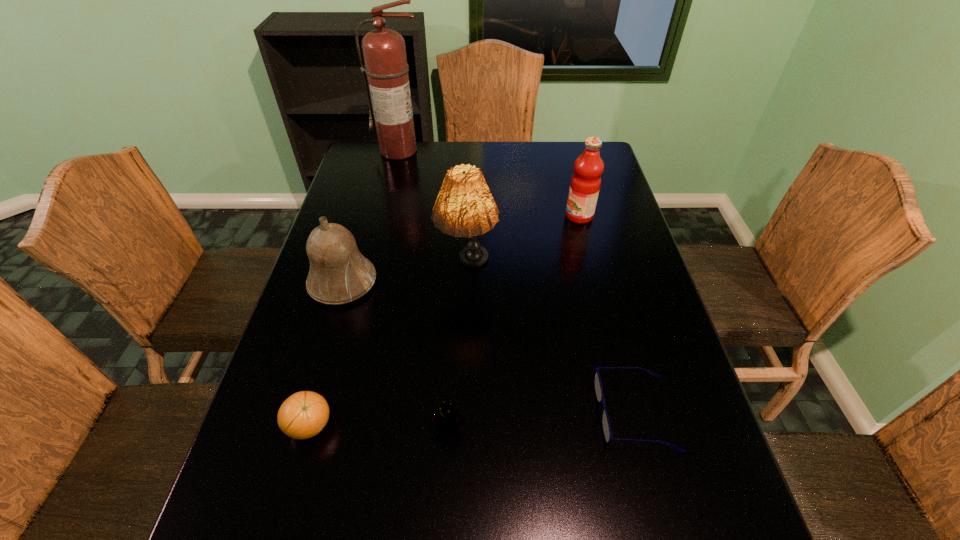
Where is `vacant area situated on the front-facing side of the lampshade`? vacant area situated on the front-facing side of the lampshade is located at coordinates (464, 393).

Find the location of a particular element. The width and height of the screenshot is (960, 540). vacant area situated on the front label of the fruit juice is located at coordinates (497, 216).

Image resolution: width=960 pixels, height=540 pixels. I want to click on free location located on the front label of the fruit juice, so click(x=478, y=216).

The image size is (960, 540). Identify the location of free space located 0.270m on the front label of the fruit juice. (478, 216).

The height and width of the screenshot is (540, 960). Identify the location of vacant space located 0.060m on the right of the bell. (399, 282).

In order to click on vacant space positioned 0.100m on the face of the Lego in this screenshot , I will do `click(445, 489)`.

This screenshot has width=960, height=540. I want to click on vacant area situated 0.380m on the right of the orange, so click(520, 426).

Where is `vacant space located 0.230m on the front-facing side of the spectacles`? vacant space located 0.230m on the front-facing side of the spectacles is located at coordinates (487, 414).

Locate an element on the screen. free point located on the front-facing side of the spectacles is located at coordinates (463, 414).

At what (x,y) coordinates should I click in order to perform the action: click on vacant space situated 0.110m on the front-facing side of the spectacles. Please return your answer as a coordinate pair (x, y). Image resolution: width=960 pixels, height=540 pixels. Looking at the image, I should click on (545, 414).